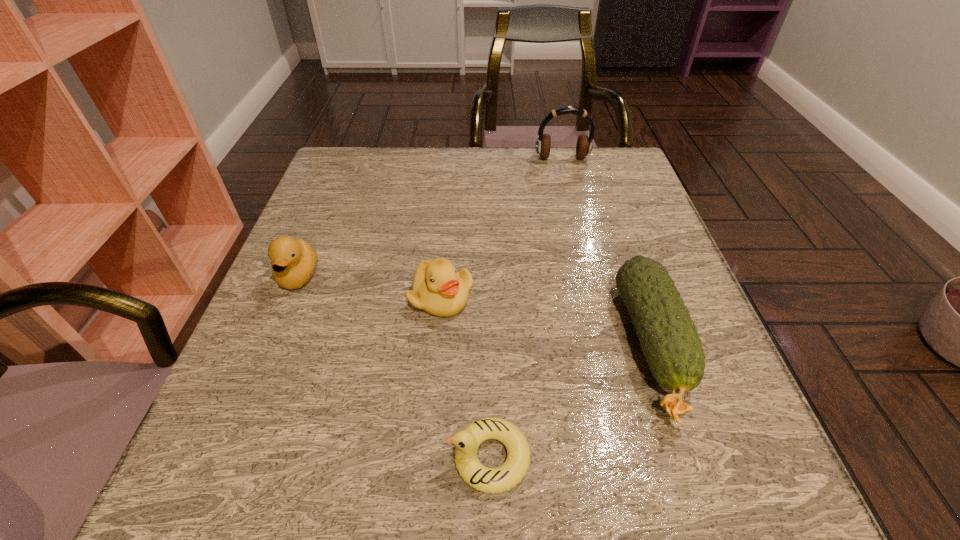
Where is `the tallest object`? Image resolution: width=960 pixels, height=540 pixels. the tallest object is located at coordinates (584, 145).

Locate an element on the screen. This screenshot has height=540, width=960. headset is located at coordinates (584, 145).

Locate an element on the screen. the leftmost duckling is located at coordinates (293, 261).

This screenshot has width=960, height=540. I want to click on cucumber, so coord(669,340).

Locate an element on the screen. This screenshot has height=540, width=960. the shortest object is located at coordinates (488, 480).

Identify the location of the shortest duckling. (488, 480).

The height and width of the screenshot is (540, 960). In order to click on vacant position located 0.170m on the ear cup of the tallest object in this screenshot , I will do `click(573, 201)`.

What are the coordinates of `free space located 0.180m facing forward on the leftmost object` in the screenshot? It's located at (255, 383).

Find the location of `blank space located 0.120m on the face of the nearest duckling`. blank space located 0.120m on the face of the nearest duckling is located at coordinates (361, 457).

Locate an element on the screen. This screenshot has height=540, width=960. free point located on the face of the nearest duckling is located at coordinates (303, 457).